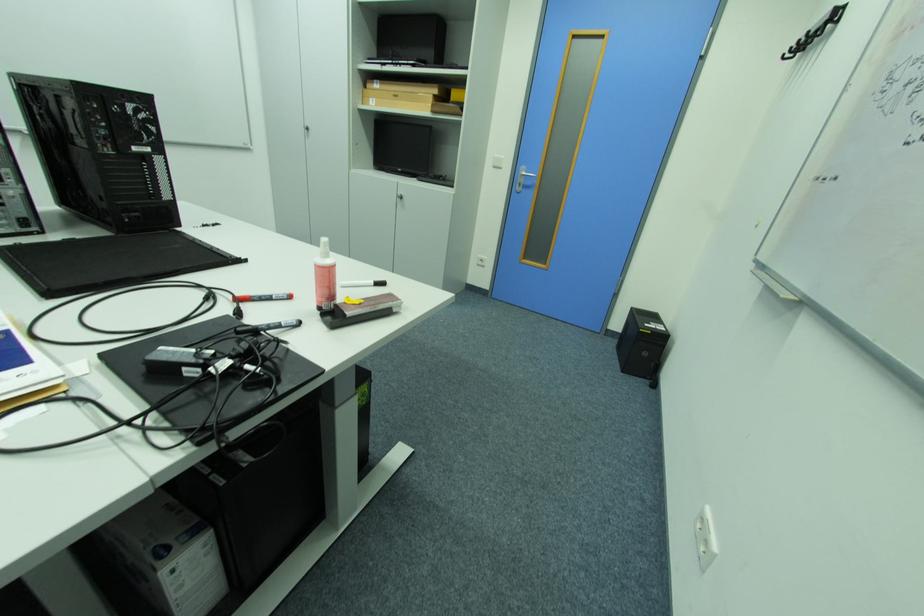
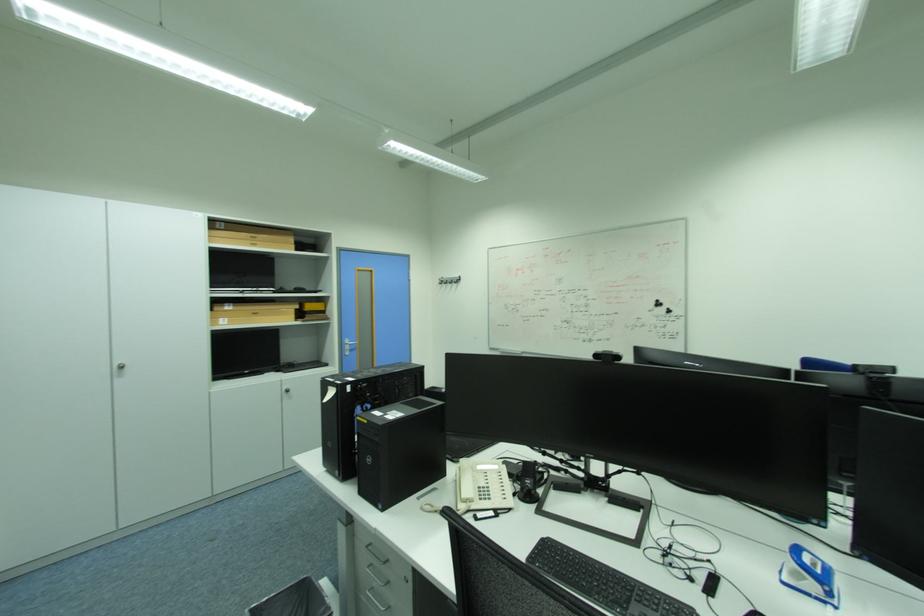
The point at (x=315, y=138) is marked in the first image. Where is the corresponding point in the second image?

(128, 376)